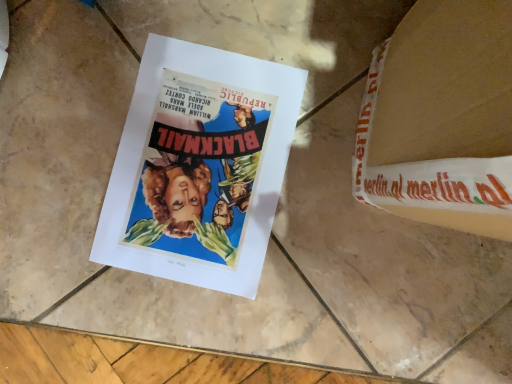
You are a GUI agent. You are given a task and a screenshot of the screen. Output one action in this format:
    pyautogui.click(x=<x>, y=<y>)
    Task: Click on the vacant space situated above matte paper poster at center (from a real-world perspective)
    
    Given the screenshot: What is the action you would take?
    pyautogui.click(x=195, y=170)